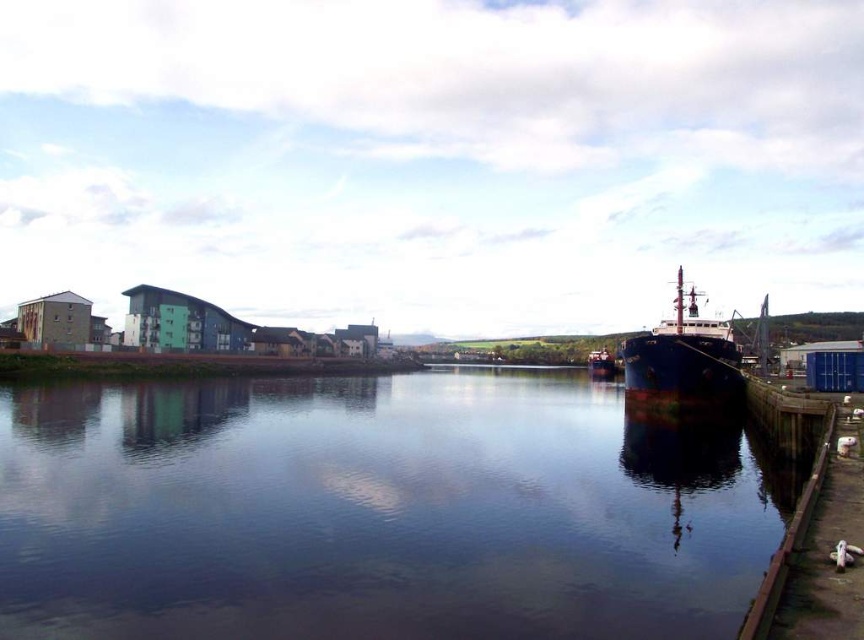
Who is shorter, blue metallic ship at right or blue metallic ship at center?

With less height is blue metallic ship at center.

Where is `blue metallic ship at right`? This screenshot has height=640, width=864. blue metallic ship at right is located at coordinates (683, 358).

This screenshot has width=864, height=640. Find the location of `blue metallic ship at right`. blue metallic ship at right is located at coordinates (683, 358).

Does smooth water at center appear on the left side of blue metallic ship at center?

Indeed, smooth water at center is positioned on the left side of blue metallic ship at center.

Between smooth water at center and blue metallic ship at center, which one has more height?

With more height is blue metallic ship at center.

Which is behind, point (386, 413) or point (598, 369)?

The point (598, 369) is more distant.

Locate an element on the screen. The width and height of the screenshot is (864, 640). smooth water at center is located at coordinates (375, 509).

Is point (726, 452) positioned in front of point (688, 344)?

Yes, it is in front of point (688, 344).

Which is more to the right, smooth water at center or blue metallic ship at right?

blue metallic ship at right is more to the right.

Between point (566, 524) and point (656, 369), which one is positioned in front?

Positioned in front is point (566, 524).

The image size is (864, 640). I want to click on smooth water at center, so click(x=375, y=509).